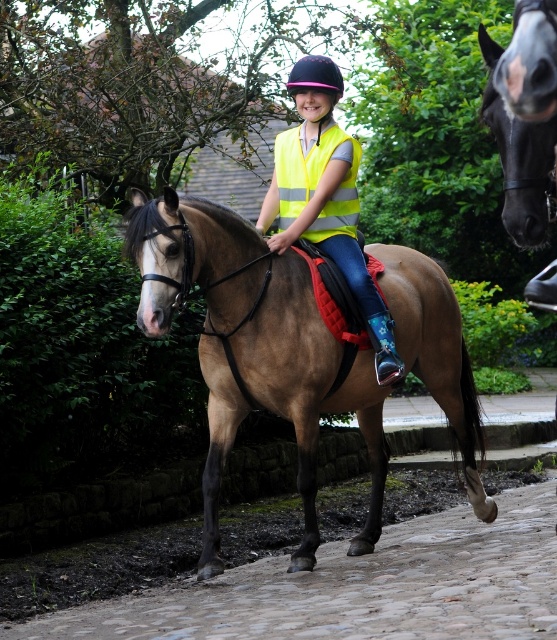
Question: Which point is closer to the camera?

Choices:
 (A) (302, 65)
 (B) (550, 570)
 (C) (335, 93)
 (D) (319, 218)

Answer: (B)

Question: Does cobblestone path at lower center appear under bright yellow reflective vest at center?

Choices:
 (A) no
 (B) yes

Answer: (B)

Question: Does neon yellow reflective vest at center have a smaller size compared to bright yellow reflective vest at center?

Choices:
 (A) yes
 (B) no

Answer: (B)

Question: Is black glossy horse at upper center to the right of purple matte helmet at upper center from the viewer's perspective?

Choices:
 (A) no
 (B) yes

Answer: (B)

Question: Which point is farther from the camera taking this photo?

Choices:
 (A) (291, 198)
 (B) (519, 230)
 (C) (361, 307)
 (D) (324, 67)

Answer: (A)

Question: Which object is the farthest from the bright yellow reflective vest at center?

Choices:
 (A) brown glossy horse at center
 (B) black glossy horse at upper center
 (C) neon yellow reflective vest at center
 (D) cobblestone path at lower center

Answer: (B)